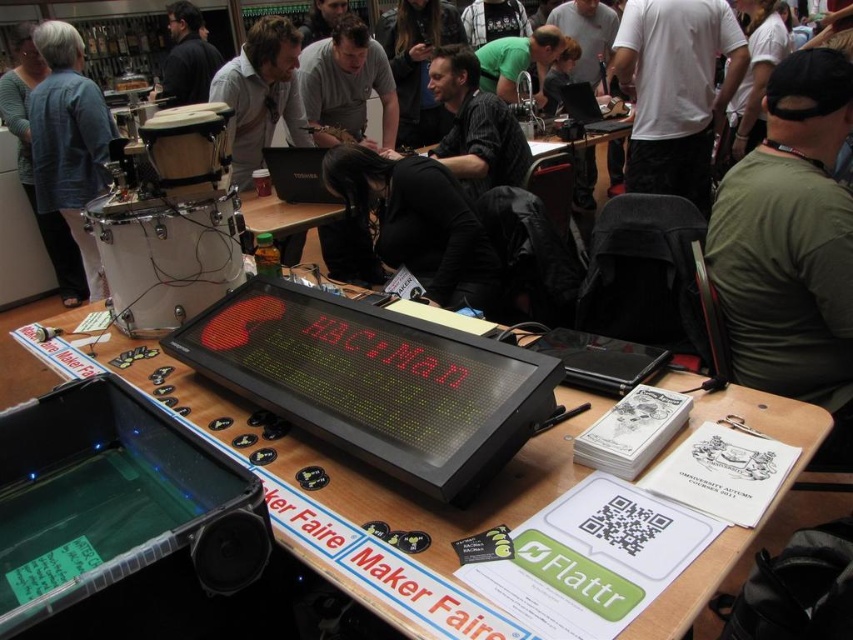
Question: Which point appears farthest from the camera in this image?

Choices:
 (A) (421, 196)
 (B) (711, 64)
 (C) (228, 68)
 (D) (234, 563)

Answer: (B)

Question: Which point is farther to the camera?

Choices:
 (A) white t-shirt at center
 (B) black plastic speaker at lower left
 (C) dark gray shirt at center
 (D) black matte shirt at center

Answer: (A)

Question: Considering the relative positions of dark green t-shirt at center-right and black plastic speaker at lower left in the image provided, where is dark green t-shirt at center-right located with respect to black plastic speaker at lower left?

Choices:
 (A) below
 (B) above

Answer: (B)

Question: Is the position of gray matte shirt at center more distant than that of black plastic speaker at lower left?

Choices:
 (A) yes
 (B) no

Answer: (A)

Question: Considering the relative positions of white t-shirt at center and denim jacket at upper left in the image provided, where is white t-shirt at center located with respect to denim jacket at upper left?

Choices:
 (A) right
 (B) left

Answer: (A)

Question: Which point is farther from the camera taking this photo?

Choices:
 (A) (772, 198)
 (B) (490, 145)

Answer: (B)